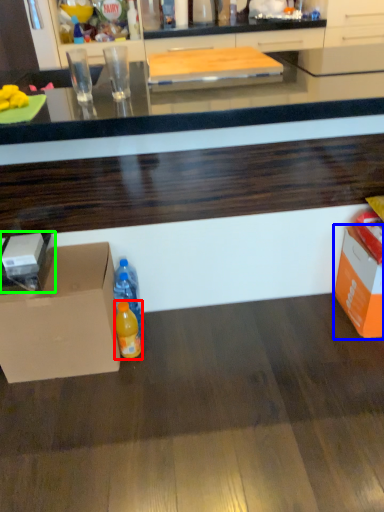
Question: Which is farther away from bottle (highlighted by a red box)? storage box (highlighted by a blue box) or box (highlighted by a green box)?

Choices:
 (A) storage box
 (B) box

Answer: (A)